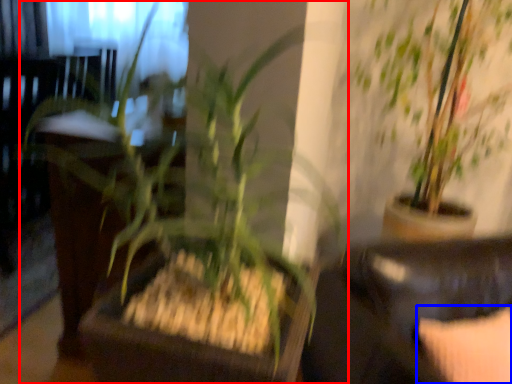
Question: Among these objects, which one is farthest to the camera, houseplant (highlighted by a red box) or pillow (highlighted by a blue box)?

Choices:
 (A) houseplant
 (B) pillow

Answer: (B)